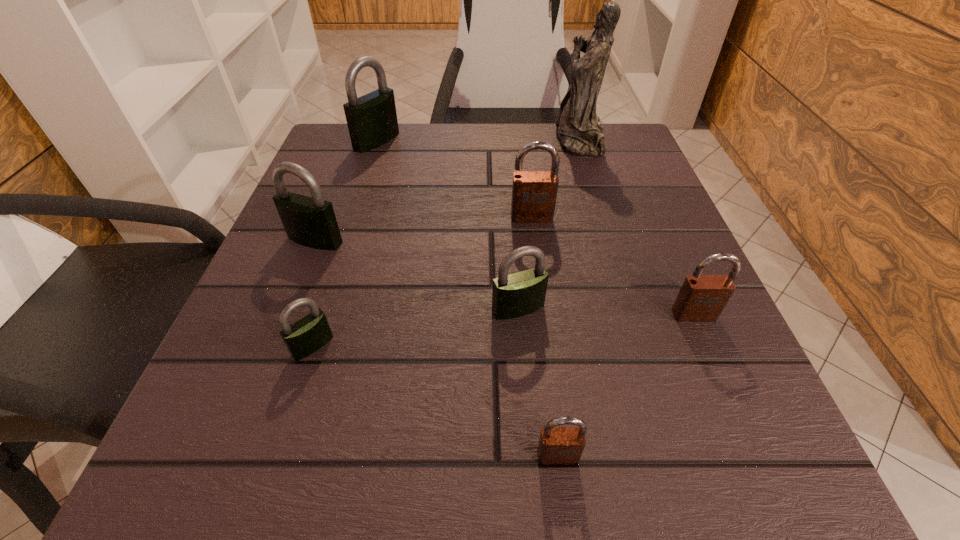
Image resolution: width=960 pixels, height=540 pixels. In order to click on vacant area between the third farthest black padlock and the figurine in this screenshot , I will do `click(548, 224)`.

At what (x,y) coordinates should I click in order to perform the action: click on free space between the farthest black padlock and the figurine. Please return your answer as a coordinate pair (x, y). This screenshot has height=540, width=960. Looking at the image, I should click on (478, 140).

Locate an element on the screen. This screenshot has width=960, height=540. free space between the nearest black padlock and the tallest object is located at coordinates (445, 243).

The height and width of the screenshot is (540, 960). In order to click on free area in between the farthest padlock and the fifth nearest padlock in this screenshot , I will do `click(346, 191)`.

Locate an element on the screen. vacant point located between the third biggest black padlock and the rightmost padlock is located at coordinates coord(606,312).

Where is `free spot between the second nearest object and the second tallest object`? This screenshot has width=960, height=540. free spot between the second nearest object and the second tallest object is located at coordinates (345, 244).

What are the coordinates of `empty space between the farthest black padlock and the seventh object from left to right` in the screenshot? It's located at [x=478, y=140].

Find the location of `free space between the rightmost black padlock and the seventh farthest object`. free space between the rightmost black padlock and the seventh farthest object is located at coordinates (416, 327).

The image size is (960, 540). What are the coordinates of `free space between the rightmost black padlock and the fourth farthest object` in the screenshot? It's located at (417, 274).

Where is `object that is the sixth closest to the biggest black padlock`? object that is the sixth closest to the biggest black padlock is located at coordinates (702, 297).